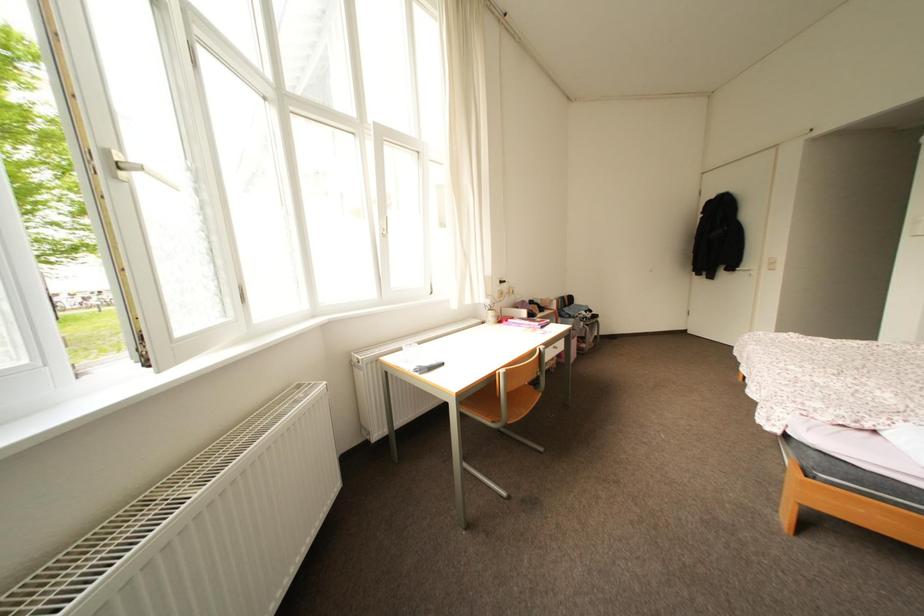
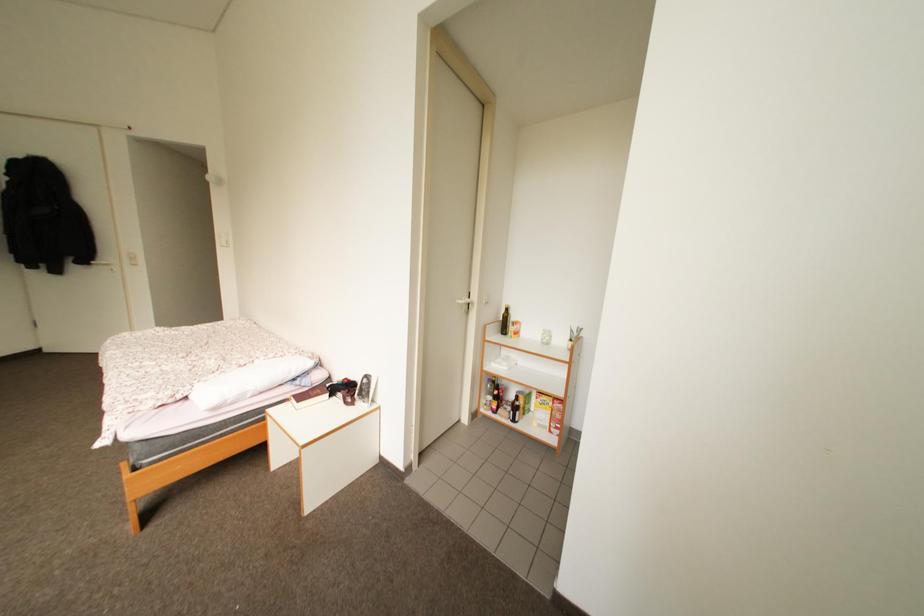
Question: The camera is either moving clockwise (left) or counter-clockwise (right) around the object. The first image is from the beginning of the video and the second image is from the end. Is the camera moving left or right when shooting the video?

Choices:
 (A) Left
 (B) Right

Answer: (A)